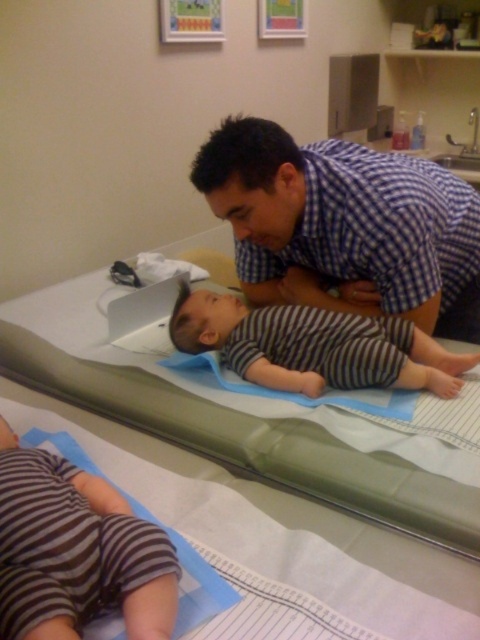
Does point (334, 504) come in front of point (25, 596)?

No, it is behind (25, 596).

Can you confirm if green fabric bed at upper center is taller than striped cotton pants at lower left?

Yes.

The width and height of the screenshot is (480, 640). In order to click on green fabric bed at upper center in this screenshot , I will do `click(278, 448)`.

The height and width of the screenshot is (640, 480). Find the location of `green fabric bed at upper center`. green fabric bed at upper center is located at coordinates (278, 448).

Does blue checkered shirt at upper center lie in front of striped fabric baby at center?

Yes, blue checkered shirt at upper center is in front of striped fabric baby at center.

Is blue checkered shirt at upper center shorter than striped fabric baby at center?

No.

Is point (242, 244) closer to viewer compared to point (315, 317)?

No, it is not.

Where is `blue checkered shirt at upper center`? blue checkered shirt at upper center is located at coordinates (345, 225).

Is blue checkered shirt at upper center to the left of green fabric bed at upper center from the viewer's perspective?

In fact, blue checkered shirt at upper center is to the right of green fabric bed at upper center.

Does blue checkered shirt at upper center appear over green fabric bed at upper center?

Indeed, blue checkered shirt at upper center is positioned over green fabric bed at upper center.

This screenshot has height=640, width=480. Describe the element at coordinates (345, 225) in the screenshot. I see `blue checkered shirt at upper center` at that location.

This screenshot has width=480, height=640. What are the coordinates of `blue checkered shirt at upper center` in the screenshot? It's located at (345, 225).